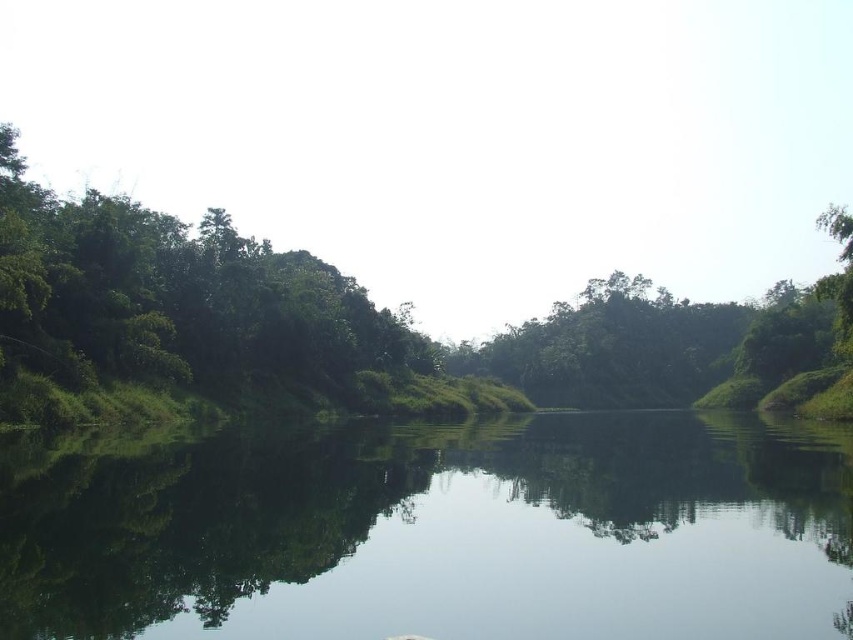
Question: Does transparent water at center have a larger size compared to green leafy tree at center?

Choices:
 (A) no
 (B) yes

Answer: (A)

Question: Among these points, which one is nearest to the camera?

Choices:
 (A) (799, 385)
 (B) (488, 436)

Answer: (B)

Question: Among these points, which one is farthest from the camera?

Choices:
 (A) (389, 480)
 (B) (532, 365)

Answer: (B)

Question: Can you confirm if transparent water at center is thinner than green leafy tree at center?

Choices:
 (A) no
 (B) yes

Answer: (B)

Question: Is transparent water at center to the right of green leafy tree at center from the viewer's perspective?

Choices:
 (A) yes
 (B) no

Answer: (B)